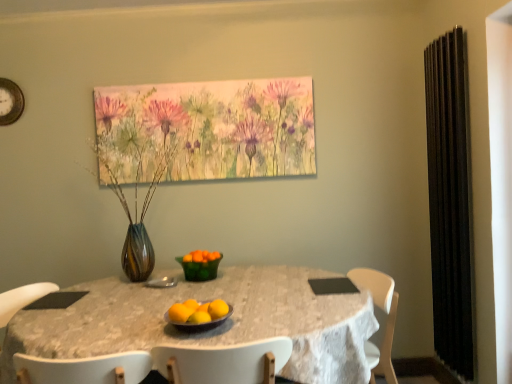
Measure the distance between point (213, 305) and camera.

A distance of 5.22 feet exists between point (213, 305) and camera.

What do you see at coordinates (450, 200) in the screenshot? This screenshot has width=512, height=384. I see `black metal radiator at right` at bounding box center [450, 200].

This screenshot has height=384, width=512. In order to click on watercolor flowers at upper center in this screenshot , I will do `click(206, 130)`.

This screenshot has width=512, height=384. What do you see at coordinates (206, 130) in the screenshot?
I see `watercolor flowers at upper center` at bounding box center [206, 130].

The image size is (512, 384). What are the coordinates of `shiny metallic bowl at center` in the screenshot? It's located at (199, 324).

Where is `orange matte at center, which is counted as the first orange, starting from the right`? orange matte at center, which is counted as the first orange, starting from the right is located at coordinates (218, 309).

Measure the distance between watercolor flowers at upper center and orange matte at center, which is counted as the first orange, starting from the right.

A distance of 4.41 feet exists between watercolor flowers at upper center and orange matte at center, which is counted as the first orange, starting from the right.

Is watercolor flowers at upper center far away from orange matte at center, which appears as the second orange when viewed from the front?

Absolutely, watercolor flowers at upper center is distant from orange matte at center, which appears as the second orange when viewed from the front.

Considering the sizes of watercolor flowers at upper center and orange matte at center, which appears as the second orange when viewed from the front, in the image, is watercolor flowers at upper center taller or shorter than orange matte at center, which appears as the second orange when viewed from the front,?

In the image, watercolor flowers at upper center appears to be taller than orange matte at center, which appears as the second orange when viewed from the front.

From the image's perspective, which is below, watercolor flowers at upper center or orange matte at center, which appears as the second orange when viewed from the front?

From the image's view, orange matte at center, which appears as the second orange when viewed from the front, is below.

Is multicolored glass vase with dried stems at center oriented away from white lace tablecloth at center?

No.

From their relative heights in the image, would you say multicolored glass vase with dried stems at center is taller or shorter than white lace tablecloth at center?

Clearly, multicolored glass vase with dried stems at center is taller compared to white lace tablecloth at center.

Which of these two, multicolored glass vase with dried stems at center or white lace tablecloth at center, is smaller?

multicolored glass vase with dried stems at center.

This screenshot has width=512, height=384. In order to click on table below the multicolored glass vase with dried stems at center (from a real-world perspective) in this screenshot , I will do `click(210, 330)`.

How far apart are orange matte at center, acting as the 1th orange starting from the left, and orange matte at center, the 3th orange viewed from the left?

A distance of 3.89 inches exists between orange matte at center, acting as the 1th orange starting from the left, and orange matte at center, the 3th orange viewed from the left.

Consider the image. Is orange matte at center, the third orange in the right-to-left sequence, to the right of orange matte at center, the 3th orange viewed from the left, from the viewer's perspective?

Incorrect, orange matte at center, the third orange in the right-to-left sequence, is not on the right side of orange matte at center, the 3th orange viewed from the left.

Based on the photo, is orange matte at center, which appears as the 1th orange when viewed from the front, aimed at orange matte at center, the 3th orange viewed from the left?

No, orange matte at center, which appears as the 1th orange when viewed from the front, is not aimed at orange matte at center, the 3th orange viewed from the left.

Which of these two, orange matte at center, the third orange in the right-to-left sequence, or orange matte at center, which appears as the second orange when viewed from the back, is wider?

With larger width is orange matte at center, the third orange in the right-to-left sequence.

Based on the photo, is white lace tablecloth at center turned away from orange matte at center, acting as the 1th orange starting from the left?

No, orange matte at center, acting as the 1th orange starting from the left, is not at the back of white lace tablecloth at center.

Between white lace tablecloth at center and orange matte at center, acting as the 1th orange starting from the left, which one has larger width?

With larger width is white lace tablecloth at center.

Which is more distant, [129,309] or [186,313]?

The point [129,309] is behind.

From the image's perspective, which is below, orange matte at center, acting as the first orange starting from the back, or black metal radiator at right?

From the image's view, orange matte at center, acting as the first orange starting from the back, is below.

Consider the image. Considering the sizes of objects orange matte at center, the second orange from the right, and black metal radiator at right in the image provided, who is smaller, orange matte at center, the second orange from the right, or black metal radiator at right?

Smaller between the two is orange matte at center, the second orange from the right.

Between orange matte at center, which ranks as the 3th orange in front-to-back order, and black metal radiator at right, which one has less height?

With less height is orange matte at center, which ranks as the 3th orange in front-to-back order.

Find the location of `the 3rd orange positioned below the black metal radiator at right (from a real-world perspective)`. the 3rd orange positioned below the black metal radiator at right (from a real-world perspective) is located at coordinates (192, 304).

How far apart are orange matte at center, which is counted as the 2th orange, starting from the left, and multicolored glass vase with dried stems at center?

1.13 meters.

Who is bigger, orange matte at center, which ranks as the 3th orange in front-to-back order, or multicolored glass vase with dried stems at center?

With larger size is multicolored glass vase with dried stems at center.

Between orange matte at center, the second orange from the right, and multicolored glass vase with dried stems at center, which one is positioned in front?

orange matte at center, the second orange from the right, is more forward.

Can you tell me how much orange matte at center, acting as the first orange starting from the back, and multicolored glass vase with dried stems at center differ in facing direction?

There is a 3.83-degree angle between the facing directions of orange matte at center, acting as the first orange starting from the back, and multicolored glass vase with dried stems at center.

Measure the distance between gold metallic clock at upper left and orange matte at center, which appears as the second orange when viewed from the front.

1.94 meters.

Which object is thinner, gold metallic clock at upper left or orange matte at center, which is counted as the first orange, starting from the right?

Thinner between the two is gold metallic clock at upper left.

Which of these two, gold metallic clock at upper left or orange matte at center, which appears as the second orange when viewed from the front, stands shorter?

orange matte at center, which appears as the second orange when viewed from the front.

Find the location of a particular element. The image size is (512, 384). clock that is behind the orange matte at center, which is counted as the first orange, starting from the right is located at coordinates (10, 102).

Where is `floral arrangement located above the orange matte at center, which appears as the second orange when viewed from the back (from the image's perspective)`? The image size is (512, 384). floral arrangement located above the orange matte at center, which appears as the second orange when viewed from the back (from the image's perspective) is located at coordinates (206, 130).

There is a white lace tablecloth at center. At what (x,y) coordinates should I click in order to perform the action: click on plant above it (from a real-world perspective). Please return your answer as a coordinate pair (x, y). Looking at the image, I should click on (136, 170).

Estimate the real-world distances between objects in this image. Which object is further from black metal radiator at right, green glass bowl at center or white lace tablecloth at center?

green glass bowl at center lies further to black metal radiator at right than the other object.

When comparing their distances from multicolored glass vase with dried stems at center, does gold metallic clock at upper left or orange matte at center, which appears as the second orange when viewed from the front, seem closer?

Based on the image, gold metallic clock at upper left appears to be nearer to multicolored glass vase with dried stems at center.

Estimate the real-world distances between objects in this image. Which object is closer to orange matte at center, acting as the first orange starting from the back, watercolor flowers at upper center or orange matte at center, which appears as the second orange when viewed from the front?

Based on the image, orange matte at center, which appears as the second orange when viewed from the front, appears to be nearer to orange matte at center, acting as the first orange starting from the back.

Based on the photo, when comparing their distances from orange matte at center, which appears as the second orange when viewed from the back, does orange matte at center, acting as the 1th orange starting from the left, or gold metallic clock at upper left seem further?

Among the two, gold metallic clock at upper left is located further to orange matte at center, which appears as the second orange when viewed from the back.

Based on their spatial positions, is orange matte at center, acting as the 1th orange starting from the left, or multicolored glass vase with dried stems at center further from watercolor flowers at upper center?

Among the two, orange matte at center, acting as the 1th orange starting from the left, is located further to watercolor flowers at upper center.

Estimate the real-world distances between objects in this image. Which object is further from black metal radiator at right, multicolored glass vase with dried stems at center or white lace tablecloth at center?

multicolored glass vase with dried stems at center lies further to black metal radiator at right than the other object.

When comparing their distances from multicolored glass vase with dried stems at center, does green glass bowl at center or gold metallic clock at upper left seem closer?

green glass bowl at center is closer to multicolored glass vase with dried stems at center.

When comparing their distances from black metal radiator at right, does orange matte at center, acting as the first orange starting from the back, or watercolor flowers at upper center seem closer?

Based on the image, watercolor flowers at upper center appears to be nearer to black metal radiator at right.

Find the location of a particular element. This screenshot has width=512, height=384. orange situated between orange matte at center, which ranks as the 3th orange in front-to-back order, and black metal radiator at right from left to right is located at coordinates (218, 309).

Find the location of a particular element. This screenshot has width=512, height=384. plant between gold metallic clock at upper left and black metal radiator at right in the horizontal direction is located at coordinates (136, 170).

Where is `glass bowl between multicolored glass vase with dried stems at center and black metal radiator at right in the horizontal direction`? glass bowl between multicolored glass vase with dried stems at center and black metal radiator at right in the horizontal direction is located at coordinates (199, 269).

Locate an element on the screen. The width and height of the screenshot is (512, 384). orange situated between orange matte at center, which appears as the 1th orange when viewed from the front, and orange matte at center, the 3th orange viewed from the left, from left to right is located at coordinates (192, 304).